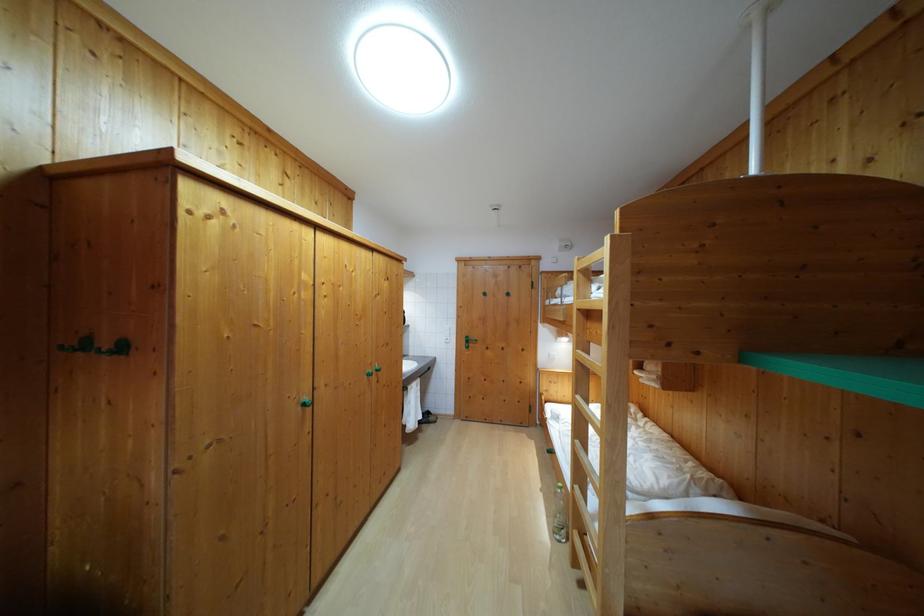
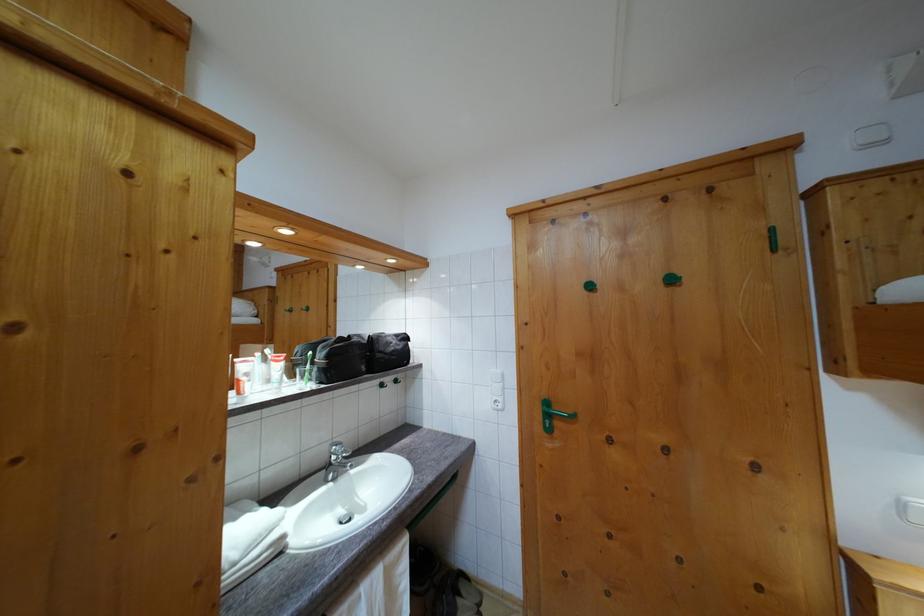
Where in the second image is the point corresponding to (470,344) from the first image?

(551, 410)